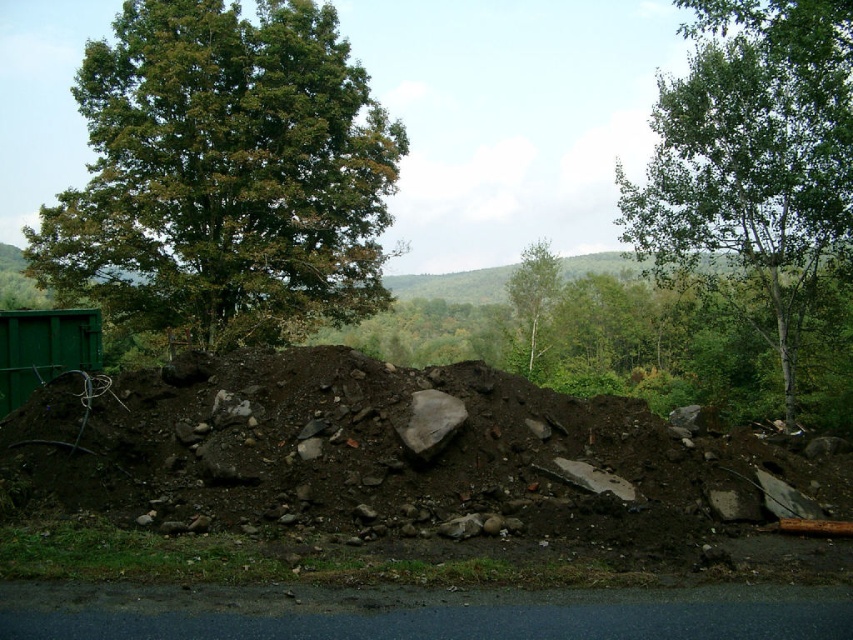
Question: Where is green leafy tree at upper left located in relation to green smooth tree at center in the image?

Choices:
 (A) left
 (B) right

Answer: (A)

Question: Does brown/dry soil at center have a smaller size compared to green leafy tree at upper left?

Choices:
 (A) no
 (B) yes

Answer: (B)

Question: Does green leafy tree at upper left have a greater width compared to green leafy tree at upper right?

Choices:
 (A) yes
 (B) no

Answer: (A)

Question: Among these objects, which one is farthest from the camera?

Choices:
 (A) green smooth tree at center
 (B) brown/dry soil at center
 (C) green leafy tree at upper right

Answer: (A)

Question: Which object appears farthest from the camera in this image?

Choices:
 (A) green leafy tree at upper right
 (B) brown/dry soil at center

Answer: (A)

Question: Which point is closer to the camera taking this photo?

Choices:
 (A) (791, 448)
 (B) (543, 312)

Answer: (A)